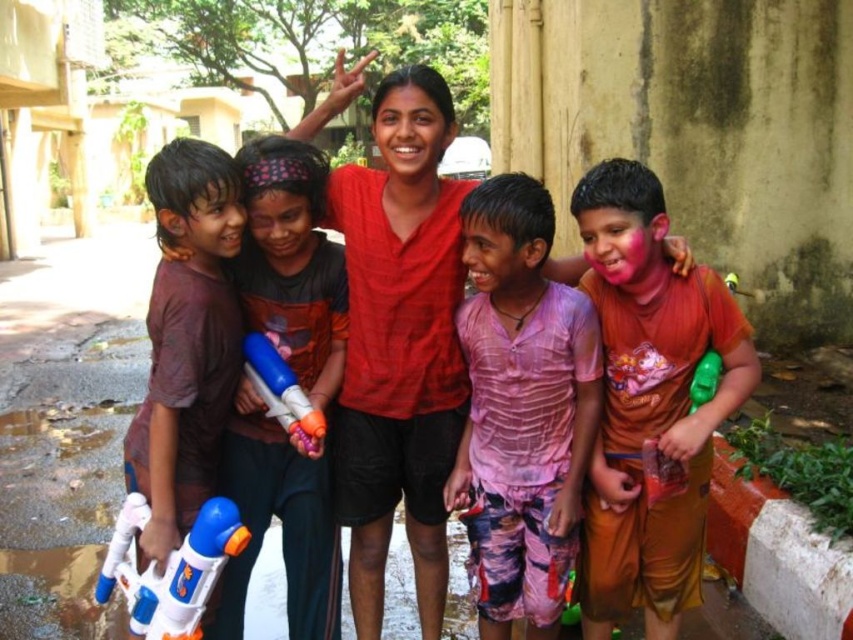
Question: In this image, where is pink fabric shirt at center located relative to matte brown shirt at center?

Choices:
 (A) right
 (B) left

Answer: (A)

Question: Does orange fabric shirt at center appear on the left side of matte brown shirt at center?

Choices:
 (A) yes
 (B) no

Answer: (B)

Question: Is pink fabric shirt at center further to the viewer compared to green rubber toy gun at right?

Choices:
 (A) yes
 (B) no

Answer: (B)

Question: Which of the following is the closest to the observer?

Choices:
 (A) (695, 368)
 (B) (492, 552)

Answer: (A)

Question: Which of these objects is positioned farthest from the brown matte water gun at left?

Choices:
 (A) pink fabric shirt at center
 (B) blue plastic water gun at center

Answer: (A)

Question: Which point is closer to the camera taking this photo?

Choices:
 (A) (270, 380)
 (B) (250, 220)

Answer: (B)